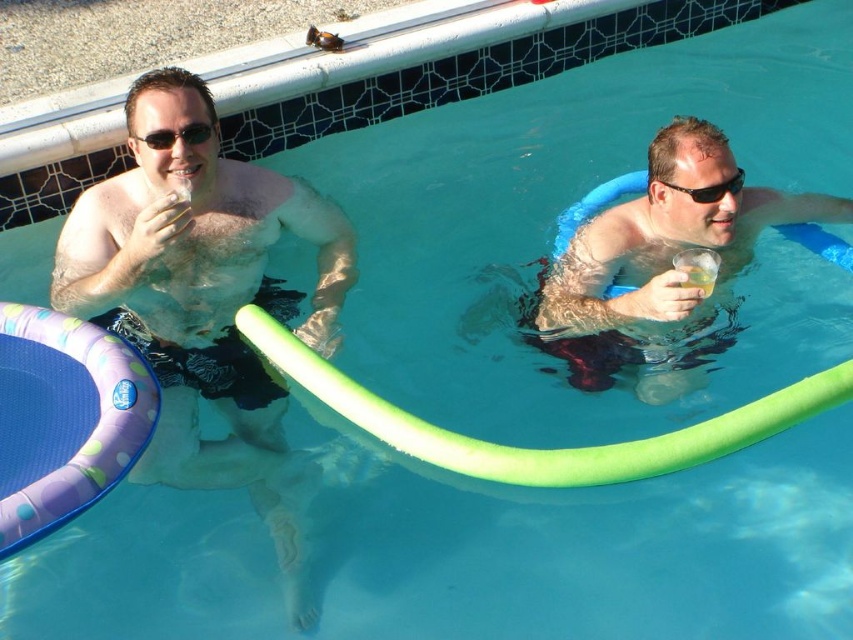
You are a photographer trying to capture a clear shot of the matte black shorts at left and the black plastic goggles at upper right. Which object should you focus on first if you want to ensure both are in focus without adjusting your camera settings?

The matte black shorts at left is located below the black plastic goggles at upper right, so focusing on the black plastic goggles at upper right first would help ensure both are in focus as they are closer to the camera.

You are a photographer trying to capture the scene of the two people by the pool. You want to ensure that both the matte black shorts at left and the matte black sunglasses at upper left are clearly visible in your photo. Considering their sizes, which object should you focus on first to ensure it is in sharp focus?

The matte black shorts at left has a greater height compared to the matte black sunglasses at upper left, so you should focus on the matte black shorts at left first since it is larger and more likely to be in focus.

You are a lifeguard standing at the edge of the pool. You need to retrieve an object that is 1.5 meters away from you. Which object between the matte black shorts at left and the black plastic goggles at upper right can you reach without moving from your position?

The matte black shorts at left is 1.44 meters from black plastic goggles at upper right. Since the distance between them is 1.44 meters, if you are at the edge where the matte black shorts at left is located, the black plastic goggles at upper right is within the 1.5 meters reach. Therefore, you can reach the black plastic goggles at upper right without moving.